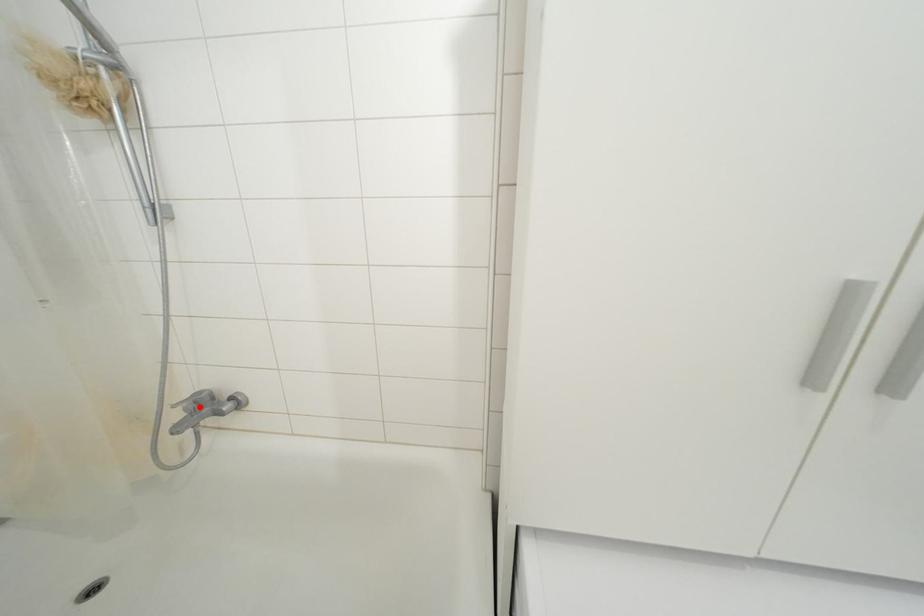
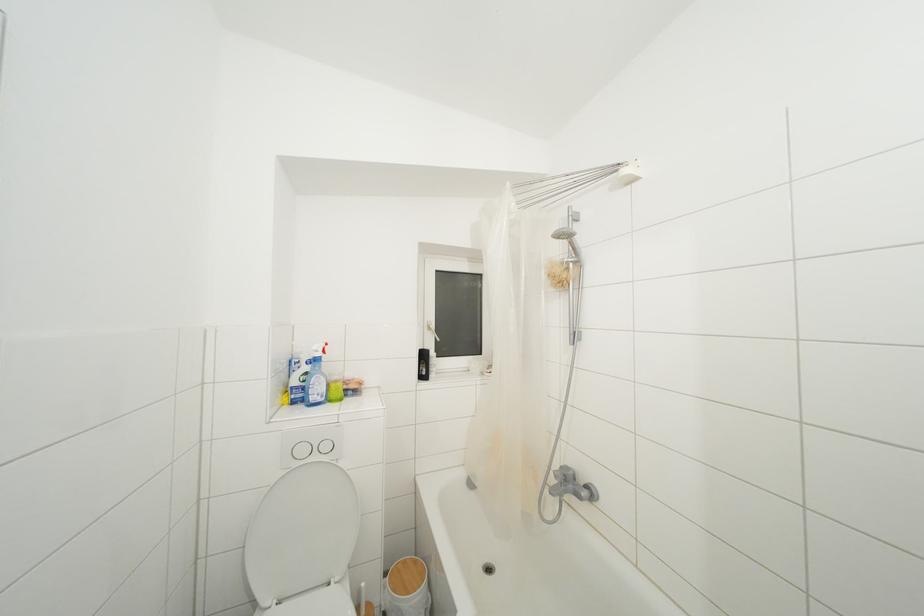
Question: A red point is marked in image1. In image2, is the corresponding 3D point closer to the camera or farther? Reply with the corresponding letter.

Choices:
 (A) The corresponding 3D point is closer.
 (B) The corresponding 3D point is farther.

Answer: (B)